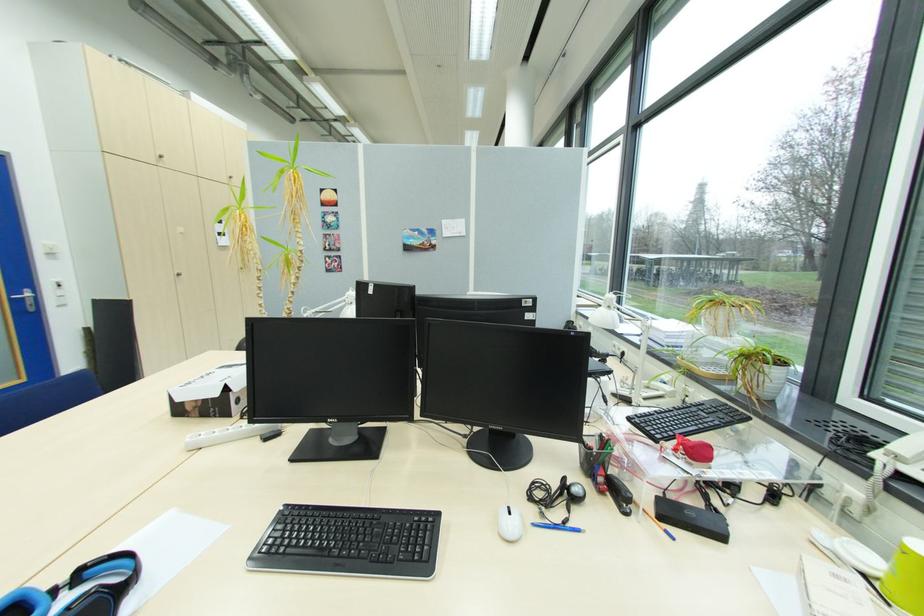
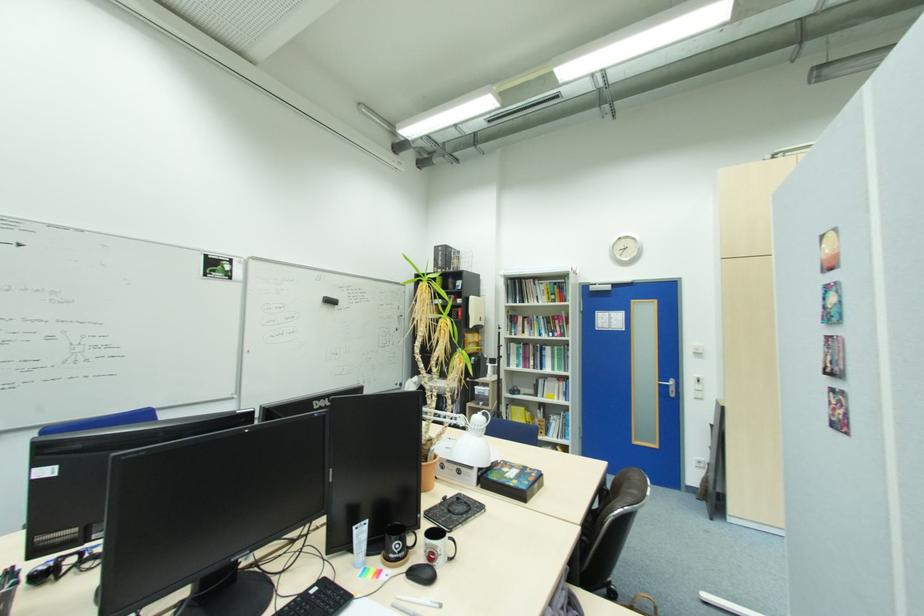
The point at (26, 300) is marked in the first image. Where is the corresponding point in the second image?

(671, 386)